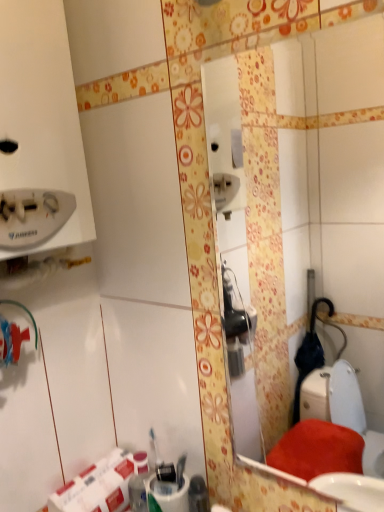
Describe the element at coordinates (319, 205) in the screenshot. I see `white glossy mirror at center` at that location.

Measure the distance between white glossy mirror at center and camera.

white glossy mirror at center is 5.15 feet from camera.

Where is `white glossy mirror at center`? white glossy mirror at center is located at coordinates (319, 205).

The height and width of the screenshot is (512, 384). What do you see at coordinates (97, 486) in the screenshot?
I see `white matte toilet paper at lower left` at bounding box center [97, 486].

In the scene shown: In order to face white matte toilet paper at lower left, should I rotate leftwards or rightwards?

You should look left and rotate roughly 12.156 degrees.

Where is `white matte toilet paper at lower left`? This screenshot has height=512, width=384. white matte toilet paper at lower left is located at coordinates (97, 486).

This screenshot has height=512, width=384. I want to click on white glossy mirror at center, so click(x=319, y=205).

Looking at this image, which object is positioned more to the right, white glossy mirror at center or white matte toilet paper at lower left?

white glossy mirror at center is more to the right.

Which object is closer to the camera taking this photo, white glossy mirror at center or white matte toilet paper at lower left?

→ Positioned in front is white glossy mirror at center.

Does point (351, 262) appear closer or farther from the camera than point (48, 504)?

Point (351, 262) is positioned farther from the camera compared to point (48, 504).

From the image's perspective, between white glossy mirror at center and white matte toilet paper at lower left, which one is located above?

white glossy mirror at center.

From a real-world perspective, is white glossy mirror at center physically above white matte toilet paper at lower left?

Yes, from a real-world perspective, white glossy mirror at center is on top of white matte toilet paper at lower left.

Considering the sizes of objects white glossy mirror at center and white matte toilet paper at lower left in the image provided, who is thinner, white glossy mirror at center or white matte toilet paper at lower left?

white glossy mirror at center is thinner.

Considering the sizes of objects white glossy mirror at center and white matte toilet paper at lower left in the image provided, who is taller, white glossy mirror at center or white matte toilet paper at lower left?

With more height is white glossy mirror at center.

Considering the relative sizes of white glossy mirror at center and white matte toilet paper at lower left in the image provided, is white glossy mirror at center smaller than white matte toilet paper at lower left?

Indeed, white glossy mirror at center has a smaller size compared to white matte toilet paper at lower left.

Does white glossy mirror at center contain white matte toilet paper at lower left?

No, white matte toilet paper at lower left is located outside of white glossy mirror at center.

Are white glossy mirror at center and white matte toilet paper at lower left beside each other?

No, white glossy mirror at center is not in contact with white matte toilet paper at lower left.

Is white matte toilet paper at lower left at the back of white glossy mirror at center?

No, white matte toilet paper at lower left is not at the back of white glossy mirror at center.

How many degrees apart are the facing directions of white glossy mirror at center and white matte toilet paper at lower left?

The angle between the facing direction of white glossy mirror at center and the facing direction of white matte toilet paper at lower left is 90.3 degrees.

This screenshot has height=512, width=384. I want to click on mirror above the white matte toilet paper at lower left (from a real-world perspective), so click(x=319, y=205).

Which is more to the left, white matte toilet paper at lower left or white glossy mirror at center?

white matte toilet paper at lower left.

Considering the positions of objects white matte toilet paper at lower left and white glossy mirror at center in the image provided, who is in front, white matte toilet paper at lower left or white glossy mirror at center?

white glossy mirror at center is closer to the camera.

Which is more distant, (113, 469) or (246, 240)?

Positioned behind is point (246, 240).

From the image's perspective, does white matte toilet paper at lower left appear higher than white glossy mirror at center?

Actually, white matte toilet paper at lower left appears below white glossy mirror at center in the image.

Consider the image. From a real-world perspective, between white matte toilet paper at lower left and white glossy mirror at center, who is vertically higher?

In real-world perspective, white glossy mirror at center is above.

Which object is wider, white matte toilet paper at lower left or white glossy mirror at center?

white matte toilet paper at lower left.

Which of these two, white matte toilet paper at lower left or white glossy mirror at center, stands shorter?

white matte toilet paper at lower left is shorter.

Considering the relative sizes of white matte toilet paper at lower left and white glossy mirror at center in the image provided, is white matte toilet paper at lower left smaller than white glossy mirror at center?

No.

Would you say white matte toilet paper at lower left contains white glossy mirror at center?

No.

Is white matte toilet paper at lower left next to white glossy mirror at center and touching it?

No, white matte toilet paper at lower left is not touching white glossy mirror at center.

Is white matte toilet paper at lower left aimed at white glossy mirror at center?

No, white matte toilet paper at lower left is not facing towards white glossy mirror at center.

Can you tell me how much white matte toilet paper at lower left and white glossy mirror at center differ in facing direction?

The angle between the facing direction of white matte toilet paper at lower left and the facing direction of white glossy mirror at center is 90.3 degrees.

This screenshot has width=384, height=512. What are the coordinates of `toilet paper that appears below the white glossy mirror at center (from a real-world perspective)` in the screenshot? It's located at (x=97, y=486).

This screenshot has width=384, height=512. Identify the location of toilet paper lying behind the white glossy mirror at center. (97, 486).

I want to click on mirror above the white matte toilet paper at lower left (from the image's perspective), so click(x=319, y=205).